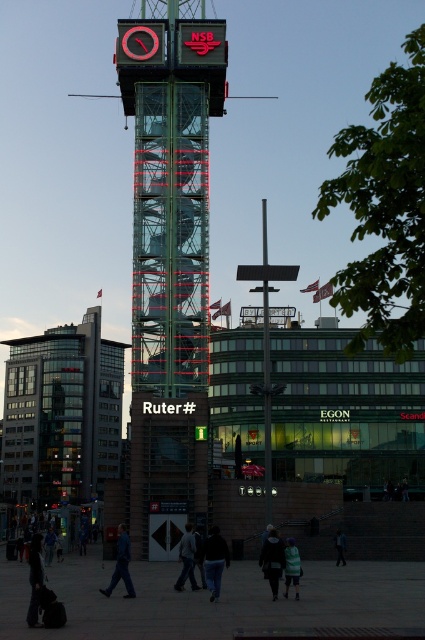
You are a tourist standing in front of the glass building at left and the green jersey at center. Which object is closer to you?

The glass building at left is closer to you than the green jersey at center.

You are a tourist standing in front of the glass building at left and the green jersey at center. You want to take a photo that includes both objects. Which object should you position closer to the camera to ensure both are in frame?

The glass building at left is taller than the green jersey at center, so you should position the green jersey at center closer to the camera to ensure both are in frame.

You are a passerby standing in front of the modern glass structure. You see a person wearing a dark gray jacket at center and dark blue jeans at lower center. Which clothing item is closer to you?

The dark gray jacket at center is closer to you because it is in front of the dark blue jeans at lower center.